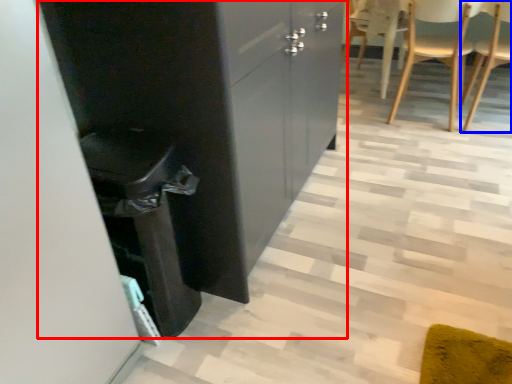
Question: Which object is further to the camera taking this photo, cabinetry (highlighted by a red box) or chair (highlighted by a blue box)?

Choices:
 (A) cabinetry
 (B) chair

Answer: (B)